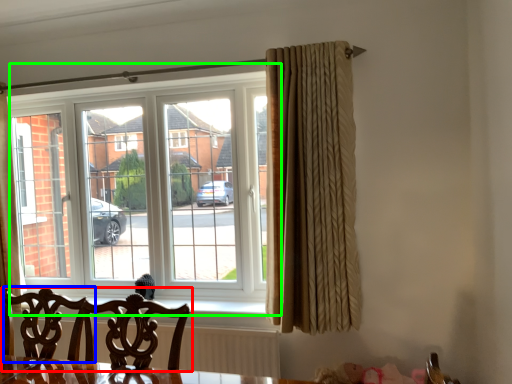
Question: Which is nearer to the chair (highlighted by a red box)? swivel chair (highlighted by a blue box) or window (highlighted by a green box).

Choices:
 (A) swivel chair
 (B) window

Answer: (A)